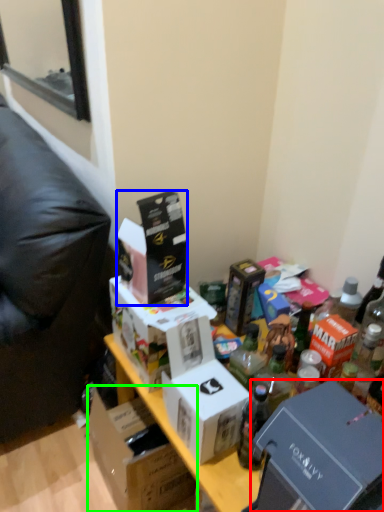
Question: Estimate the real-world distances between objects in this image. Which object is farther from box (highlighted by a red box), box (highlighted by a blue box) or box (highlighted by a green box)?

Choices:
 (A) box
 (B) box

Answer: (B)